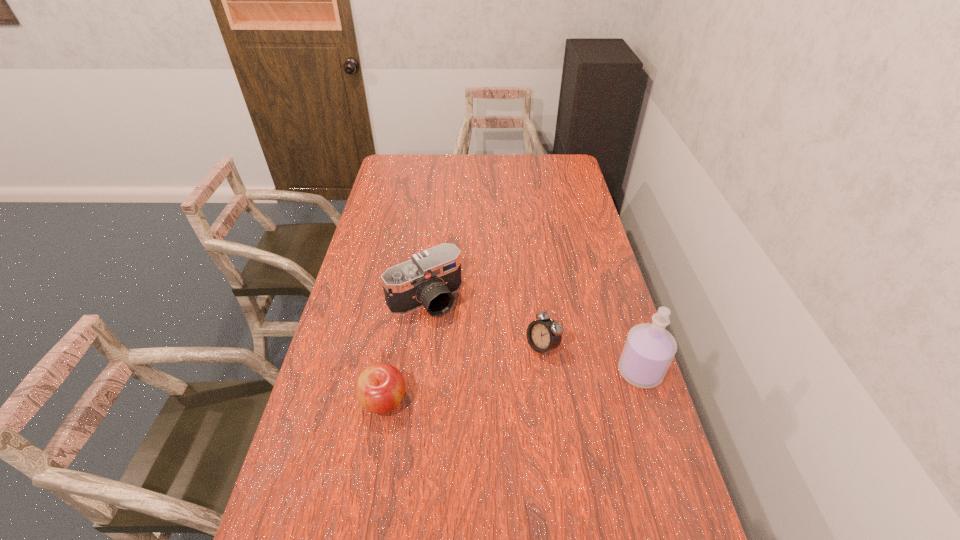
The width and height of the screenshot is (960, 540). What are the coordinates of `apple` in the screenshot? It's located at (380, 387).

You are a GUI agent. You are given a task and a screenshot of the screen. Output one action in this format:
    pyautogui.click(x=<x>, y=<y>)
    Task: Click on the rightmost object
    
    Given the screenshot: What is the action you would take?
    pyautogui.click(x=649, y=349)

In order to click on the tallest object in this screenshot , I will do `click(649, 349)`.

Identify the location of the second object from right to left. (543, 335).

You are a GUI agent. You are given a task and a screenshot of the screen. Output one action in this format:
    pyautogui.click(x=<x>, y=<y>)
    Task: Click on the camera
    The image size is (960, 540).
    Given the screenshot: What is the action you would take?
    pyautogui.click(x=429, y=279)

The image size is (960, 540). What are the coordinates of `the farthest object` in the screenshot? It's located at (429, 279).

Find the location of `vacant space located 0.190m on the stem of the apple`. vacant space located 0.190m on the stem of the apple is located at coordinates (367, 498).

This screenshot has height=540, width=960. I want to click on vacant space located on the back of the tallest object, so click(609, 273).

Find the location of a particular element. This screenshot has height=540, width=960. blank space located on the face of the second object from right to left is located at coordinates point(420,429).

Where is `vacant space located 0.080m on the face of the second object from right to left`? vacant space located 0.080m on the face of the second object from right to left is located at coordinates (510, 369).